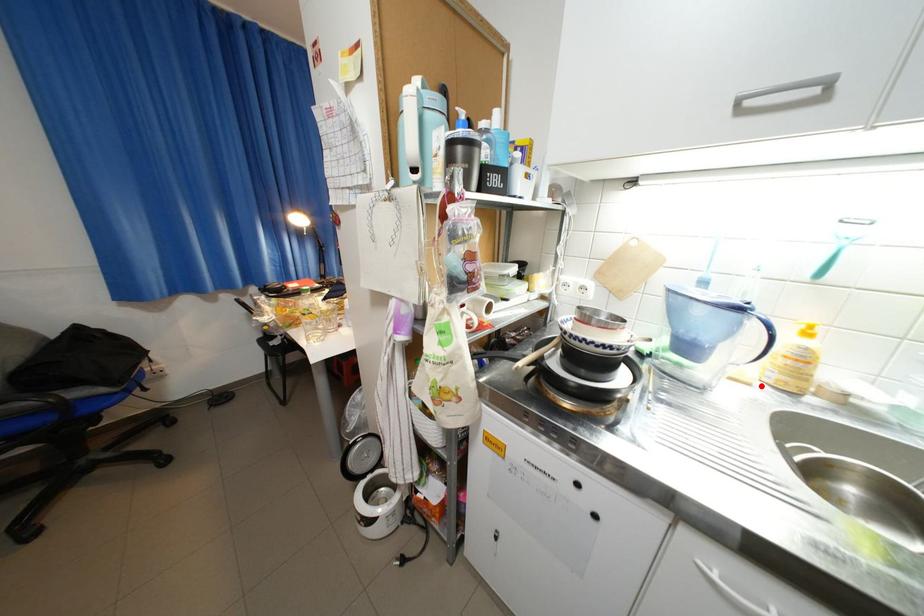
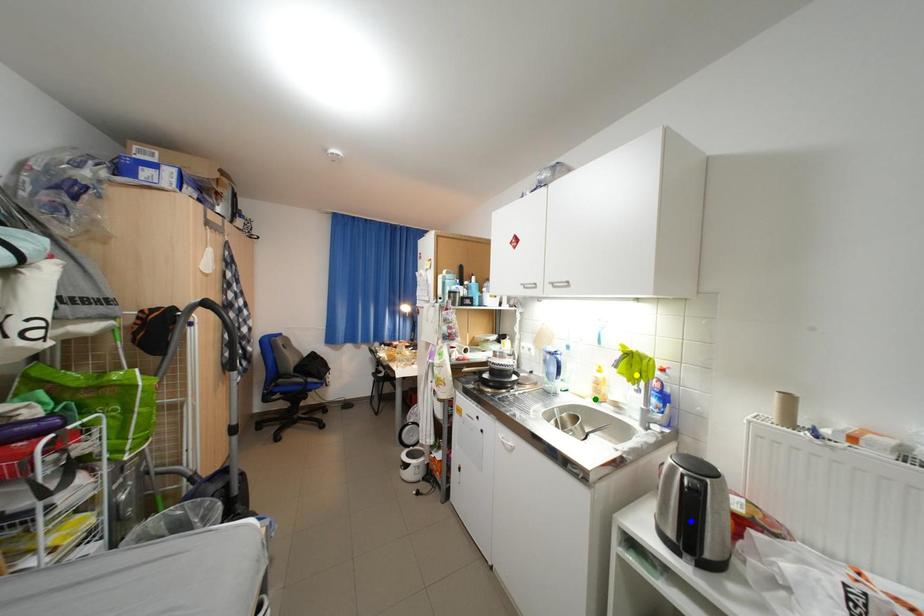
Question: I am providing you with two images of the same scene from different viewpoints. A red point is marked on the first image. You are given multiple points on the second image. Can you choose the point in image 2 that corresponds to the point in image 1?

Choices:
 (A) green point
 (B) yellow point
 (C) blue point

Answer: (A)